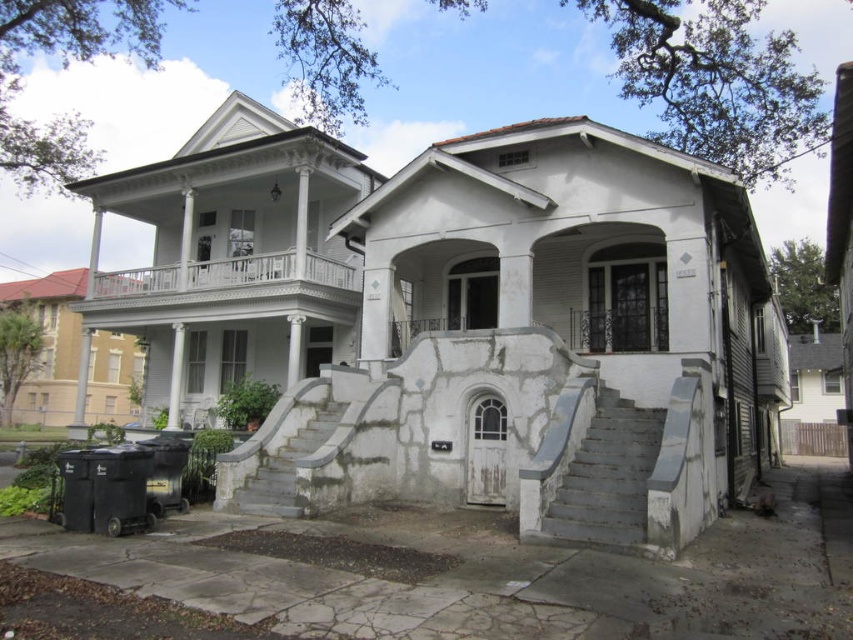
Question: Which is nearer to the gray concrete stairs at lower right?

Choices:
 (A) gray concrete stairs at center
 (B) white painted wood porch at upper center

Answer: (A)

Question: Among these points, which one is nearest to the camera?

Choices:
 (A) (357, 284)
 (B) (595, 486)

Answer: (B)

Question: Among these objects, which one is farthest from the camera?

Choices:
 (A) white painted wood porch at upper center
 (B) gray concrete stairs at lower right
 (C) gray concrete stairs at center

Answer: (A)

Question: Can you confirm if white painted wood porch at upper center is positioned above gray concrete stairs at center?

Choices:
 (A) yes
 (B) no

Answer: (A)

Question: Does white painted wood porch at upper center appear on the right side of gray concrete stairs at center?

Choices:
 (A) no
 (B) yes

Answer: (A)

Question: Is white painted wood porch at upper center closer to camera compared to gray concrete stairs at center?

Choices:
 (A) no
 (B) yes

Answer: (A)